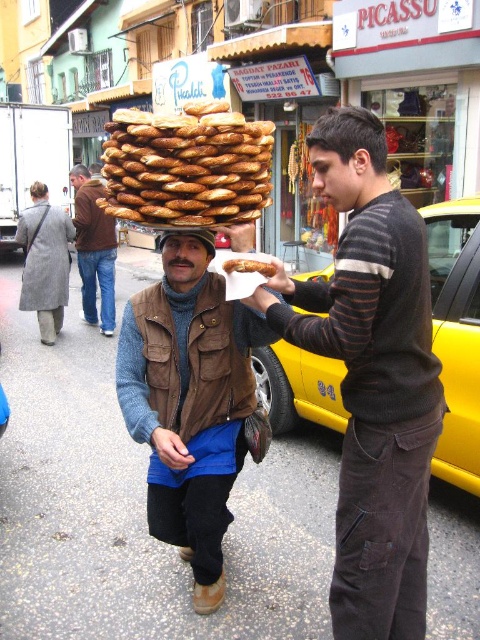
You are a customer in this street scene. You see the brown leather hat at center and the golden brown bread at center. Which object is positioned to the left from your perspective?

The brown leather hat at center is to the left of the golden brown bread at center.

You are a pedestrian standing at the center of the street. You see a yellow metallic taxi at right and a brown leather jacket at center. Which object is closer to your current position?

The brown leather jacket at center is closer to your current position because it is located at the center, while the yellow metallic taxi at right is positioned to the right of it.